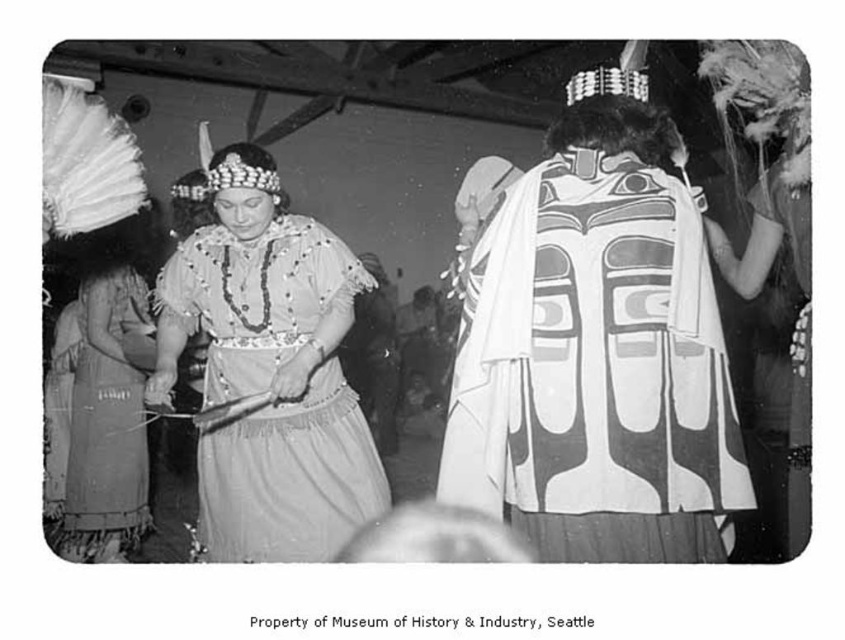
From the picture: You are a photographer at the event and want to capture a photo that includes both the matte fabric dress at center and the textured gray dress at left. What is the minimum distance you need to maintain between them to ensure both are in frame?

The minimum distance you need to maintain between the matte fabric dress at center and the textured gray dress at left is 33.85 inches to ensure both are in frame.

You are observing a historical black and white photograph of a cultural event. In the image, there are two individuals wearing distinct dresses. One is wearing a matte fabric dress at center and another in a textured gray dress at left. Based on their positions, which dress appears closer to the front of the scene?

The matte fabric dress at center appears closer to the front of the scene because it is positioned above the textured gray dress at left, indicating it is in a more forward position.